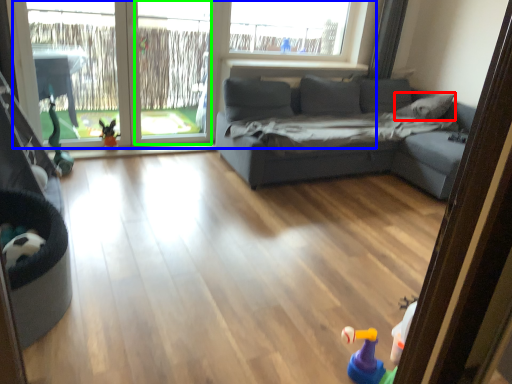
Question: Which is nearer to the pillow (highlighted by a red box)? window (highlighted by a blue box) or window screen (highlighted by a green box).

Choices:
 (A) window
 (B) window screen

Answer: (A)